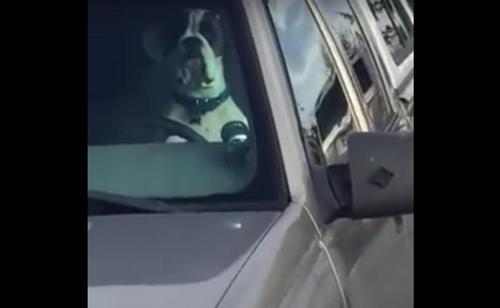
Identify the location of door. This screenshot has width=500, height=308. (367, 261).